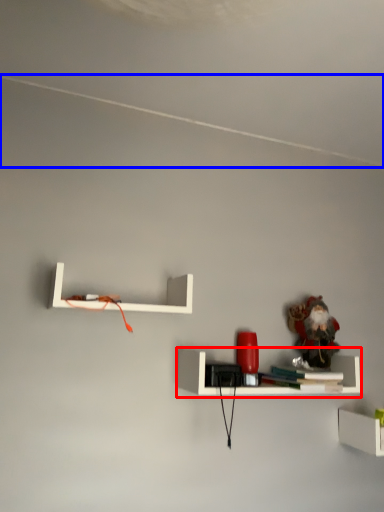
Question: Which object is closer to the camera taking this photo, shelf (highlighted by a red box) or line (highlighted by a blue box)?

Choices:
 (A) shelf
 (B) line

Answer: (B)